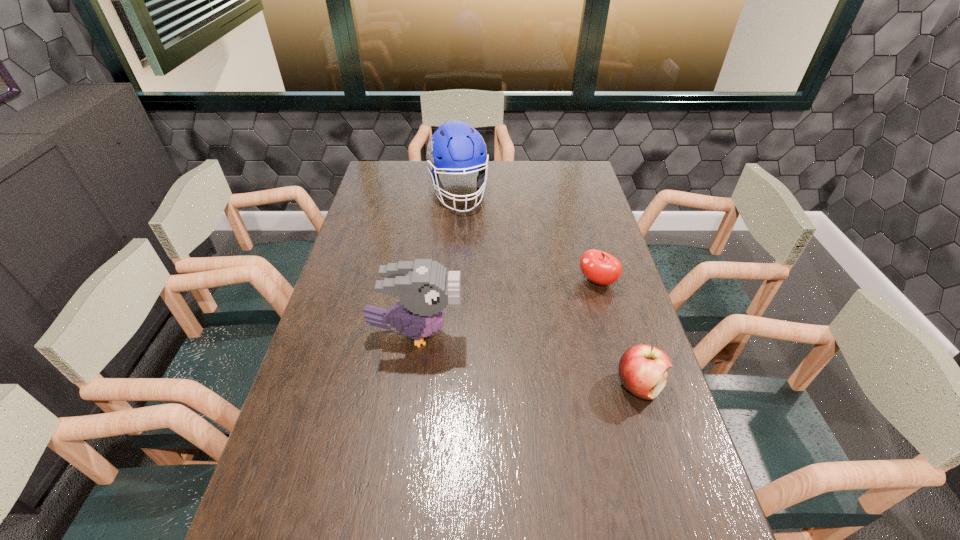
This screenshot has width=960, height=540. What are the coordinates of `free space on the desktop that is between the third farthest object and the nearest object and is positioned on the face guard of the farthest object` in the screenshot? It's located at (511, 355).

You are a GUI agent. You are given a task and a screenshot of the screen. Output one action in this format:
    pyautogui.click(x=<x>, y=<y>)
    Task: Click on the vacant space on the desktop that is between the third farthest object and the nearer apple and is positioned on the stem of the farther apple
    This screenshot has height=540, width=960.
    Given the screenshot: What is the action you would take?
    pyautogui.click(x=512, y=356)